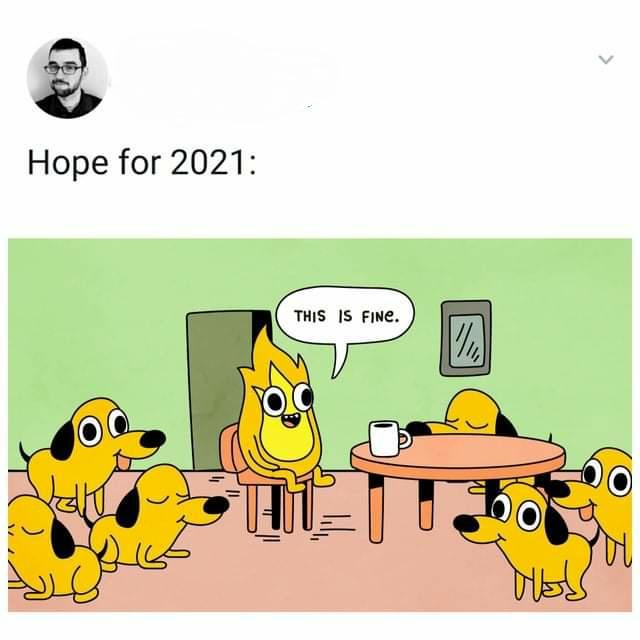
You are a GUI agent. You are given a task and a screenshot of the screen. Output one action in this format:
    pyautogui.click(x=<x>, y=<y>)
    Task: Click on the chair legs
    The width and height of the screenshot is (640, 640).
    Given the screenshot: What is the action you would take?
    pyautogui.click(x=252, y=500), pyautogui.click(x=273, y=500), pyautogui.click(x=287, y=508), pyautogui.click(x=310, y=508)